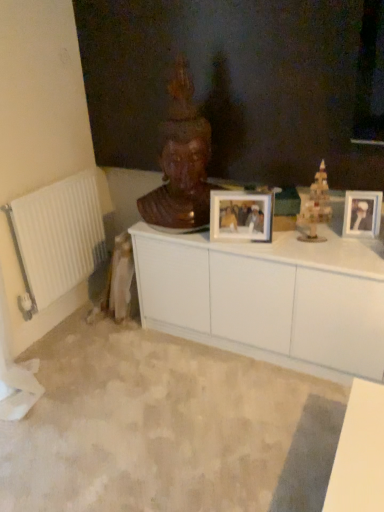
Locate an element on the screen. wooden statue at center is located at coordinates (181, 162).

You are a GUI agent. You are given a task and a screenshot of the screen. Output one action in this format:
    pyautogui.click(x=<x>, y=<y>)
    Task: Click on the white metal radiator at left
    
    Given the screenshot: What is the action you would take?
    pyautogui.click(x=57, y=238)

This screenshot has width=384, height=512. What do you see at coordinates (241, 216) in the screenshot?
I see `white glossy picture frame at center, acting as the second picture frame starting from the right` at bounding box center [241, 216].

Measure the distance between point (314, 199) and camera.

The distance of point (314, 199) from camera is 1.82 meters.

The height and width of the screenshot is (512, 384). What do you see at coordinates (268, 298) in the screenshot?
I see `white matte cabinet at center` at bounding box center [268, 298].

Where is `wooden statue at center`? The height and width of the screenshot is (512, 384). wooden statue at center is located at coordinates (181, 162).

From the image's perspective, would you say white metal radiator at left is shown under white plastic picture frame at upper right, the second picture frame in the left-to-right sequence?

Yes, from the image's perspective, white metal radiator at left is beneath white plastic picture frame at upper right, the second picture frame in the left-to-right sequence.

From the picture: From a real-world perspective, is white metal radiator at left located beneath white plastic picture frame at upper right, the second picture frame in the left-to-right sequence?

Yes, from a real-world perspective, white metal radiator at left is beneath white plastic picture frame at upper right, the second picture frame in the left-to-right sequence.

Considering the relative sizes of white metal radiator at left and white plastic picture frame at upper right, the second picture frame in the left-to-right sequence, in the image provided, is white metal radiator at left taller than white plastic picture frame at upper right, the second picture frame in the left-to-right sequence,?

Yes.

Is wooden statue at center next to white matte cabinet at center and touching it?

wooden statue at center is not next to white matte cabinet at center, and they're not touching.

From the image's perspective, does wooden statue at center appear higher than white matte cabinet at center?

Correct, wooden statue at center appears higher than white matte cabinet at center in the image.

Is wooden statue at center further to the viewer compared to white matte cabinet at center?

Yes.

From a real-world perspective, is white glossy picture frame at center, the first picture frame in the left-to-right sequence, positioned above or below white plastic picture frame at upper right, the second picture frame in the left-to-right sequence?

From a real-world perspective, white glossy picture frame at center, the first picture frame in the left-to-right sequence, is physically above white plastic picture frame at upper right, the second picture frame in the left-to-right sequence.

The image size is (384, 512). Find the location of `picture frame that appears in front of the white plastic picture frame at upper right, the second picture frame in the left-to-right sequence`. picture frame that appears in front of the white plastic picture frame at upper right, the second picture frame in the left-to-right sequence is located at coordinates (241, 216).

Considering the positions of objects white glossy picture frame at center, the first picture frame in the left-to-right sequence, and white plastic picture frame at upper right, the second picture frame in the left-to-right sequence, in the image provided, who is more to the right, white glossy picture frame at center, the first picture frame in the left-to-right sequence, or white plastic picture frame at upper right, the second picture frame in the left-to-right sequence,?

white plastic picture frame at upper right, the second picture frame in the left-to-right sequence.

Between white glossy picture frame at center, the first picture frame in the left-to-right sequence, and white plastic picture frame at upper right, the 1th picture frame viewed from the right, which one has less height?

white plastic picture frame at upper right, the 1th picture frame viewed from the right.

Does white metal radiator at left have a greater height compared to white matte cabinet at center?

Indeed, white metal radiator at left has a greater height compared to white matte cabinet at center.

What's the angular difference between white metal radiator at left and white matte cabinet at center's facing directions?

They differ by 90.3 degrees in their facing directions.

Is white metal radiator at left to the left or to the right of white matte cabinet at center in the image?

Based on their positions, white metal radiator at left is located to the left of white matte cabinet at center.

How many degrees apart are the facing directions of wooden statue at center and white plastic picture frame at upper right, the 1th picture frame viewed from the right?

There is a 29-degree angle between the facing directions of wooden statue at center and white plastic picture frame at upper right, the 1th picture frame viewed from the right.

In the scene shown: Does wooden statue at center have a greater width compared to white plastic picture frame at upper right, the 1th picture frame viewed from the right?

Correct, the width of wooden statue at center exceeds that of white plastic picture frame at upper right, the 1th picture frame viewed from the right.

The height and width of the screenshot is (512, 384). I want to click on person that appears on the left of white plastic picture frame at upper right, the 1th picture frame viewed from the right, so click(x=181, y=162).

Looking at this image, considering the sizes of wooden statue at center and white plastic picture frame at upper right, the second picture frame in the left-to-right sequence, in the image, is wooden statue at center taller or shorter than white plastic picture frame at upper right, the second picture frame in the left-to-right sequence,?

In the image, wooden statue at center appears to be taller than white plastic picture frame at upper right, the second picture frame in the left-to-right sequence.

Who is shorter, wooden tower at upper right or white metal radiator at left?

Standing shorter between the two is wooden tower at upper right.

Can you confirm if wooden tower at upper right is positioned to the left of white metal radiator at left?

No, wooden tower at upper right is not to the left of white metal radiator at left.

From the image's perspective, which is below, wooden tower at upper right or white metal radiator at left?

→ white metal radiator at left, from the image's perspective.

Is point (310, 223) more distant than point (23, 310)?

No, (310, 223) is closer to viewer.

Considering the relative sizes of white plastic picture frame at upper right, the second picture frame in the left-to-right sequence, and white glossy picture frame at center, the first picture frame in the left-to-right sequence, in the image provided, is white plastic picture frame at upper right, the second picture frame in the left-to-right sequence, shorter than white glossy picture frame at center, the first picture frame in the left-to-right sequence,?

Yes.

Is white plastic picture frame at upper right, the second picture frame in the left-to-right sequence, in front of white glossy picture frame at center, the first picture frame in the left-to-right sequence?

No, it is not.

From the image's perspective, who appears lower, white plastic picture frame at upper right, the 1th picture frame viewed from the right, or white glossy picture frame at center, the first picture frame in the left-to-right sequence?

From the image's view, white glossy picture frame at center, the first picture frame in the left-to-right sequence, is below.

What are the coordinates of `radiator lying behind the white plastic picture frame at upper right, the second picture frame in the left-to-right sequence` in the screenshot? It's located at (57, 238).

The height and width of the screenshot is (512, 384). In order to click on cabinetry beneath the wooden statue at center (from a real-world perspective) in this screenshot , I will do `click(268, 298)`.

Considering their positions, is white glossy picture frame at center, acting as the second picture frame starting from the right, positioned further to wooden statue at center than white plastic picture frame at upper right, the second picture frame in the left-to-right sequence?

Among the two, white plastic picture frame at upper right, the second picture frame in the left-to-right sequence, is located further to wooden statue at center.

Based on their spatial positions, is wooden tower at upper right or white matte cabinet at center closer to white metal radiator at left?

white matte cabinet at center lies closer to white metal radiator at left than the other object.

Based on their spatial positions, is wooden statue at center or white matte cabinet at center closer to white metal radiator at left?

wooden statue at center is positioned closer to the anchor white metal radiator at left.

Based on their spatial positions, is white glossy picture frame at center, the first picture frame in the left-to-right sequence, or white plastic picture frame at upper right, the second picture frame in the left-to-right sequence, closer to white metal radiator at left?

white glossy picture frame at center, the first picture frame in the left-to-right sequence, lies closer to white metal radiator at left than the other object.

Looking at the image, which one is located closer to wooden tower at upper right, white matte cabinet at center or white glossy picture frame at center, acting as the second picture frame starting from the right?

white glossy picture frame at center, acting as the second picture frame starting from the right, lies closer to wooden tower at upper right than the other object.

Which object lies nearer to the anchor point white metal radiator at left, white matte cabinet at center or white plastic picture frame at upper right, the 1th picture frame viewed from the right?

white matte cabinet at center lies closer to white metal radiator at left than the other object.

Estimate the real-world distances between objects in this image. Which object is closer to white metal radiator at left, white plastic picture frame at upper right, the 1th picture frame viewed from the right, or wooden tower at upper right?

wooden tower at upper right is closer to white metal radiator at left.

From the image, which object appears to be farther from white metal radiator at left, wooden tower at upper right or white glossy picture frame at center, acting as the second picture frame starting from the right?

wooden tower at upper right.

You are a GUI agent. You are given a task and a screenshot of the screen. Output one action in this format:
    pyautogui.click(x=<x>, y=<y>)
    Task: Click on the cabinetry situated between white glossy picture frame at center, acting as the second picture frame starting from the right, and white plastic picture frame at upper right, the second picture frame in the left-to-right sequence, from left to right
    This screenshot has width=384, height=512.
    Given the screenshot: What is the action you would take?
    pyautogui.click(x=268, y=298)

I want to click on person between white metal radiator at left and white matte cabinet at center in the horizontal direction, so (x=181, y=162).

Locate an element on the screen. toy between white metal radiator at left and white plastic picture frame at upper right, the 1th picture frame viewed from the right is located at coordinates (316, 207).

What are the coordinates of `cabinetry between white metal radiator at left and wooden tower at upper right in the horizontal direction` in the screenshot? It's located at (268, 298).